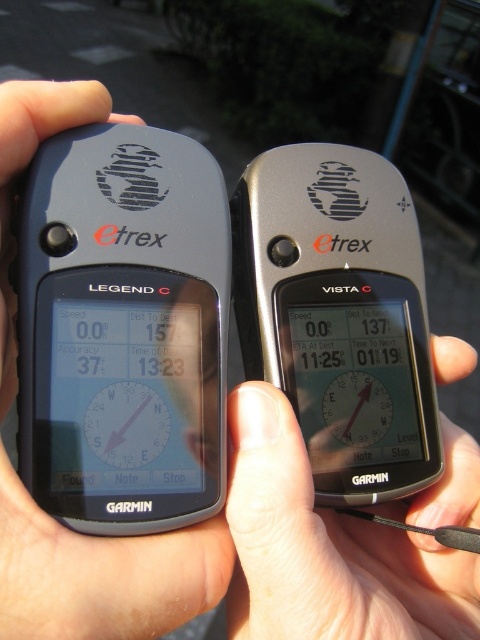
The height and width of the screenshot is (640, 480). What do you see at coordinates (325, 548) in the screenshot?
I see `skinny silver phone at center` at bounding box center [325, 548].

Does skinny silver phone at center have a larger size compared to black matte gps device at center?

No.

Does point (276, 620) come in front of point (86, 554)?

No, it is not.

What are the coordinates of `skinny silver phone at center` in the screenshot? It's located at (325, 548).

Is black matte gps device at center above matte black clock at center?

A: Indeed, black matte gps device at center is positioned over matte black clock at center.

Does point (29, 106) come behind point (121, 467)?

Yes.

Which is behind, point (196, 561) or point (139, 458)?

The point (139, 458) is more distant.

The width and height of the screenshot is (480, 640). In order to click on black matte gps device at center in this screenshot , I will do `click(101, 573)`.

Does skinny silver phone at center have a greater height compared to matte black clock at center?

Yes.

Between skinny silver phone at center and matte black clock at center, which one is positioned lower?

skinny silver phone at center is lower down.

Who is more distant from viewer, (384, 630) or (147, 426)?

Positioned behind is point (147, 426).

You are a GUI agent. You are given a task and a screenshot of the screen. Output one action in this format:
    pyautogui.click(x=<x>, y=<y>)
    Task: Click on the skinny silver phone at center
    
    Given the screenshot: What is the action you would take?
    (325, 548)